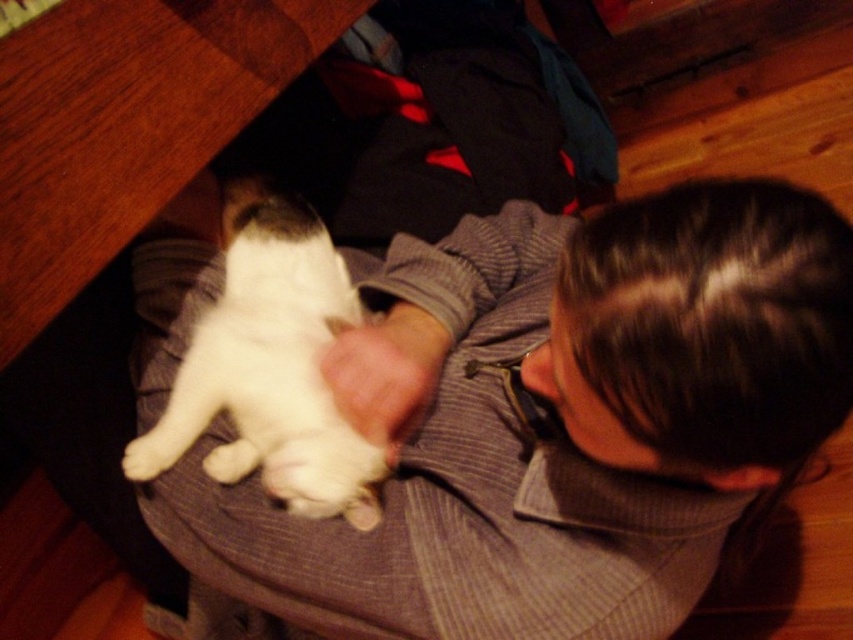
Does striped sweater at center lie in front of white fur cat at center?

That is True.

Can you confirm if striped sweater at center is positioned to the right of white fur cat at center?

Yes, striped sweater at center is to the right of white fur cat at center.

Does point (488, 339) come behind point (339, 442)?

Yes, point (488, 339) is farther from viewer.

The height and width of the screenshot is (640, 853). I want to click on striped sweater at center, so click(525, 416).